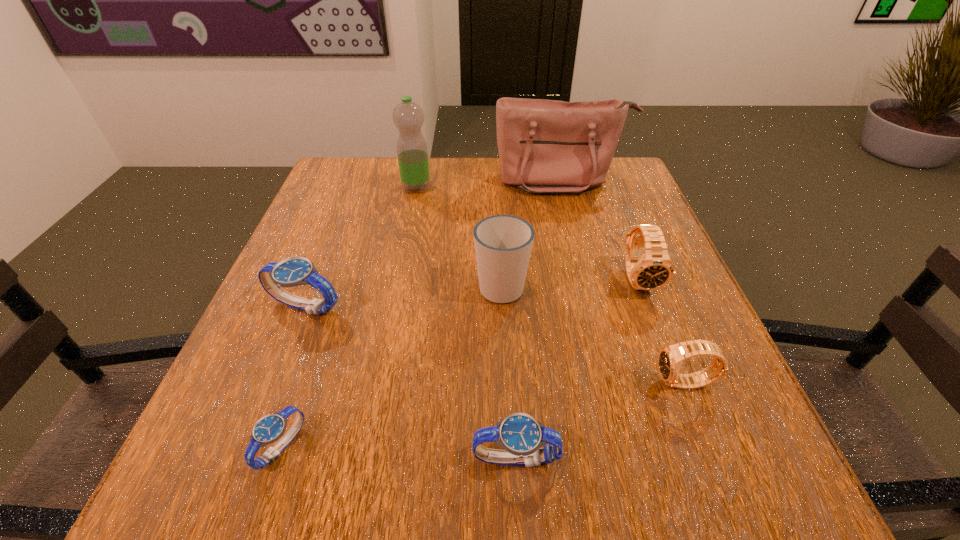
In order to click on the third watch from left to right in this screenshot , I will do `click(520, 434)`.

The image size is (960, 540). I want to click on the smallest blue watch, so click(270, 428).

Identify the location of the shortest watch. The height and width of the screenshot is (540, 960). (270, 428).

I want to click on vacant space located 0.140m on the right of the water bottle, so click(x=486, y=188).

You are a GUI agent. You are given a task and a screenshot of the screen. Output one action in this format:
    pyautogui.click(x=<x>, y=<y>)
    Task: Click on the blank space located 0.120m on the front pocket of the shoulder bag
    This screenshot has width=960, height=540.
    Given the screenshot: What is the action you would take?
    pyautogui.click(x=572, y=227)

Image resolution: width=960 pixels, height=540 pixels. Identify the location of free space located with a handle on the side of the cup. (496, 195).

Find the location of `free space located with a handle on the side of the cup`. free space located with a handle on the side of the cup is located at coordinates (497, 205).

Where is `free space located with a handle on the side of the cup`? free space located with a handle on the side of the cup is located at coordinates (498, 235).

The height and width of the screenshot is (540, 960). I want to click on vacant space located 0.070m on the face of the tallest watch, so click(x=658, y=329).

At what (x,y) coordinates should I click in order to perform the action: click on vacant space located 0.180m on the right of the farthest blue watch. Please return your answer as a coordinate pair (x, y). Looking at the image, I should click on (441, 306).